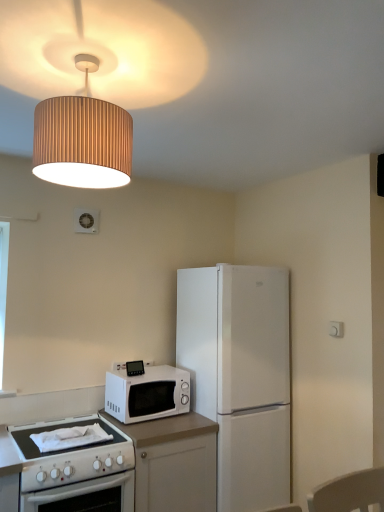
Question: From the image's perspective, is white matte microwave at center located above white laminate countertop at lower left?

Choices:
 (A) yes
 (B) no

Answer: (A)

Question: Are white matte microwave at center and white laminate countertop at lower left located far from each other?

Choices:
 (A) yes
 (B) no

Answer: (B)

Question: Is white matte microwave at center shorter than white laminate countertop at lower left?

Choices:
 (A) no
 (B) yes

Answer: (B)

Question: Does white matte microwave at center appear on the right side of white laminate countertop at lower left?

Choices:
 (A) yes
 (B) no

Answer: (B)

Question: Does white matte microwave at center lie in front of white laminate countertop at lower left?

Choices:
 (A) no
 (B) yes

Answer: (A)

Question: Is wooden lampshade at upper center taller or shorter than white matte microwave at center?

Choices:
 (A) short
 (B) tall

Answer: (B)

Question: Would you say wooden lampshade at upper center is to the left or to the right of white matte microwave at center in the picture?

Choices:
 (A) left
 (B) right

Answer: (A)

Question: Considering the positions of point (97, 28) and point (187, 389), is point (97, 28) closer or farther from the camera than point (187, 389)?

Choices:
 (A) closer
 (B) farther

Answer: (A)

Question: Is wooden lampshade at upper center in front of or behind white matte microwave at center in the image?

Choices:
 (A) behind
 (B) front

Answer: (B)

Question: Considering the relative positions of white matte refrigerator at center-right and white matte microwave at center in the image provided, is white matte refrigerator at center-right to the left or to the right of white matte microwave at center?

Choices:
 (A) right
 (B) left

Answer: (A)

Question: Looking at the image, does white matte refrigerator at center-right seem bigger or smaller compared to white matte microwave at center?

Choices:
 (A) big
 (B) small

Answer: (A)

Question: Considering the positions of white matte refrigerator at center-right and white matte microwave at center in the image, is white matte refrigerator at center-right wider or thinner than white matte microwave at center?

Choices:
 (A) wide
 (B) thin

Answer: (A)

Question: Do you think white matte refrigerator at center-right is within white matte microwave at center, or outside of it?

Choices:
 (A) inside
 (B) outside

Answer: (B)

Question: From a real-world perspective, is white laminate countertop at lower left physically located above or below white matte refrigerator at center-right?

Choices:
 (A) above
 (B) below

Answer: (B)

Question: From the image's perspective, is white laminate countertop at lower left located above or below white matte refrigerator at center-right?

Choices:
 (A) below
 (B) above

Answer: (A)